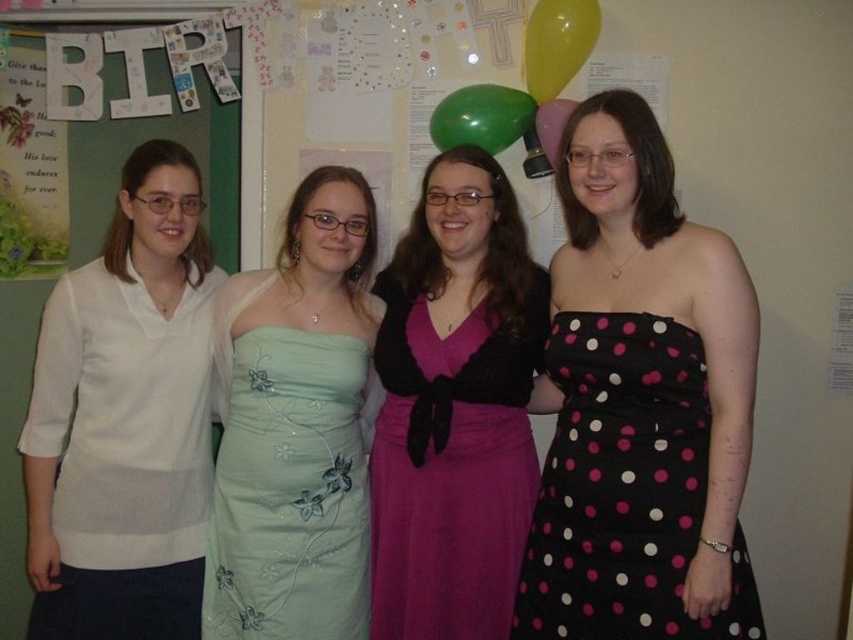
Can you confirm if white cotton shirt at left is wider than green rubber balloon at upper center?

Yes, white cotton shirt at left is wider than green rubber balloon at upper center.

Does white cotton shirt at left appear on the left side of green rubber balloon at upper center?

Indeed, white cotton shirt at left is positioned on the left side of green rubber balloon at upper center.

Find the location of a particular element. white cotton shirt at left is located at coordinates (125, 419).

Describe the element at coordinates (556, 44) in the screenshot. This screenshot has height=640, width=853. I see `yellow rubber balloon at upper right` at that location.

Is yellow rubber balloon at upper right thinner than green rubber balloon at upper center?

Yes.

Where is `yellow rubber balloon at upper right`? yellow rubber balloon at upper right is located at coordinates (556, 44).

Who is more distant from viewer, (567, 38) or (540, 113)?

The point (540, 113) is behind.

In the scene shown: Who is positioned more to the left, yellow rubber balloon at upper right or rubber balloon at upper center?

yellow rubber balloon at upper right

Is point (556, 90) closer to camera compared to point (548, 164)?

That is True.

You are a GUI agent. You are given a task and a screenshot of the screen. Output one action in this format:
    pyautogui.click(x=<x>, y=<y>)
    Task: Click on the yellow rubber balloon at upper right
    
    Given the screenshot: What is the action you would take?
    pyautogui.click(x=556, y=44)